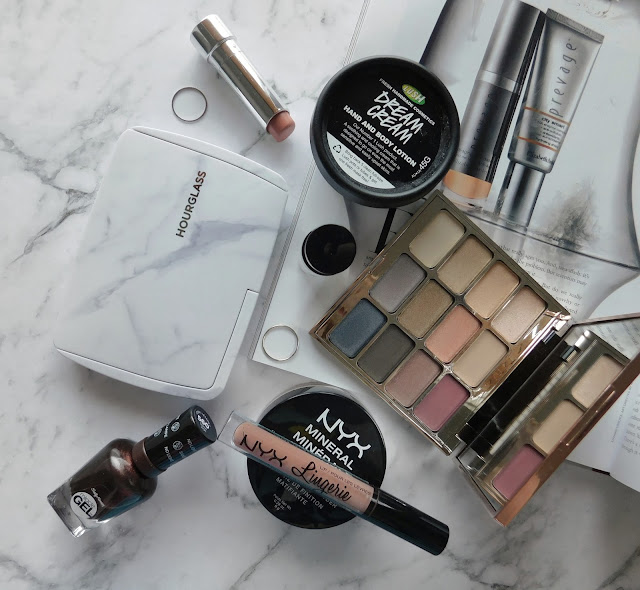
Identify the location of makeup mirror. (534, 428).